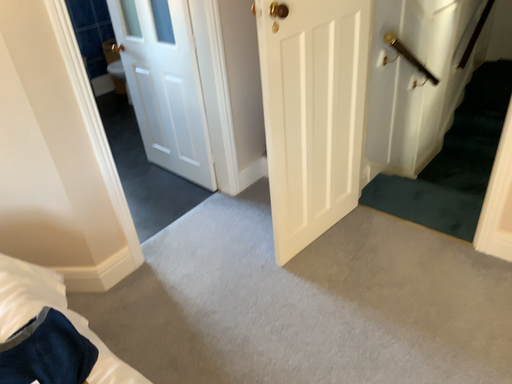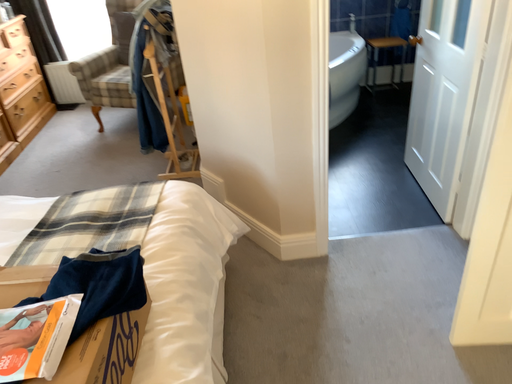
Question: How did the camera likely rotate when shooting the video?

Choices:
 (A) rotated left
 (B) rotated right

Answer: (A)